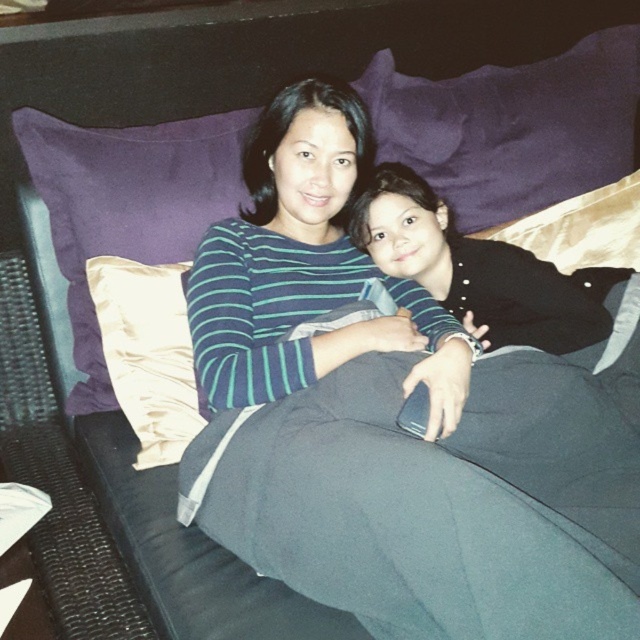
Question: Is purple fabric pillow at upper center above satin beige pillow at left?

Choices:
 (A) yes
 (B) no

Answer: (A)

Question: Considering the real-world distances, which object is farthest from the satin beige pillow at left?

Choices:
 (A) satin cushion at upper left
 (B) purple fabric pillow at upper center

Answer: (B)

Question: Which object is the farthest from the satin beige pillow at left?

Choices:
 (A) purple fabric pillow at upper center
 (B) satin cushion at upper left

Answer: (A)

Question: Which point is closer to the camera?

Choices:
 (A) (141, 422)
 (B) (196, 157)
 (C) (374, 100)

Answer: (A)

Question: Is purple fabric pillow at upper center below satin cushion at upper left?

Choices:
 (A) no
 (B) yes

Answer: (A)

Question: Can you confirm if purple fabric pillow at upper center is smaller than satin cushion at upper left?

Choices:
 (A) yes
 (B) no

Answer: (B)